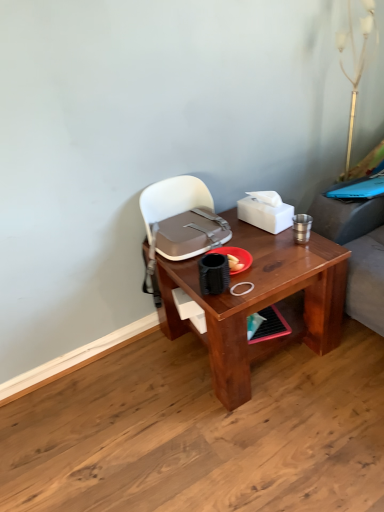
The height and width of the screenshot is (512, 384). I want to click on vacant area in front of white matte tissue box at upper right, so click(x=269, y=243).